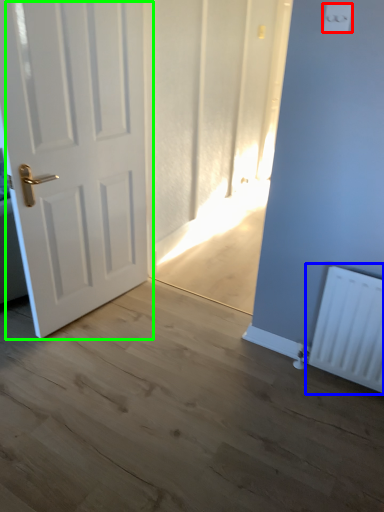
Question: Which object is the closest to the light switch (highlighted by a red box)? Choose among these: radiator (highlighted by a blue box) or door (highlighted by a green box).

Choices:
 (A) radiator
 (B) door

Answer: (A)